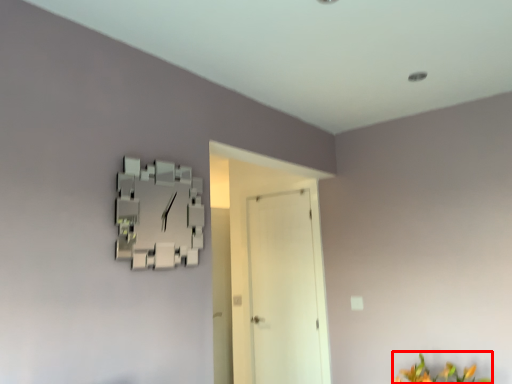
Question: From the image's perspective, what is the correct spatial positioning of flower (annotated by the red box) in reference to door?

Choices:
 (A) above
 (B) below

Answer: (B)